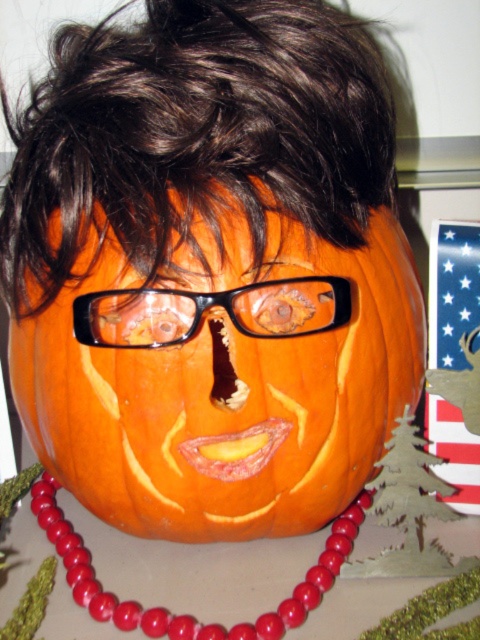
Question: Is orange carved pumpkin at center further to the viewer compared to dark brown hair at upper center?

Choices:
 (A) yes
 (B) no

Answer: (A)

Question: Which object appears farthest from the camera in this image?

Choices:
 (A) red beads at center
 (B) dark brown hair at upper center

Answer: (A)

Question: Among these points, which one is farthest from the camera?

Choices:
 (A) (394, 301)
 (B) (72, 218)
 (C) (129, 609)

Answer: (A)

Question: Which object appears closest to the camera in this image?

Choices:
 (A) orange carved pumpkin at center
 (B) red beads at center
 (C) dark brown hair at upper center

Answer: (C)

Question: Can you confirm if dark brown hair at upper center is smaller than red beads at center?

Choices:
 (A) yes
 (B) no

Answer: (B)

Question: Does orange carved pumpkin at center appear over red beads at center?

Choices:
 (A) no
 (B) yes

Answer: (B)